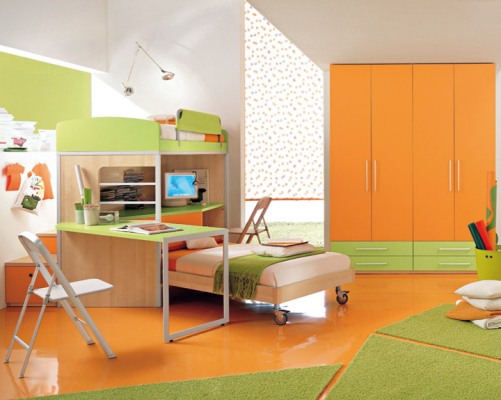
At what (x,y) coordinates should I click in order to perform the action: click on computer monitor. Please return your answer as a coordinate pair (x, y). Looking at the image, I should click on (174, 188).